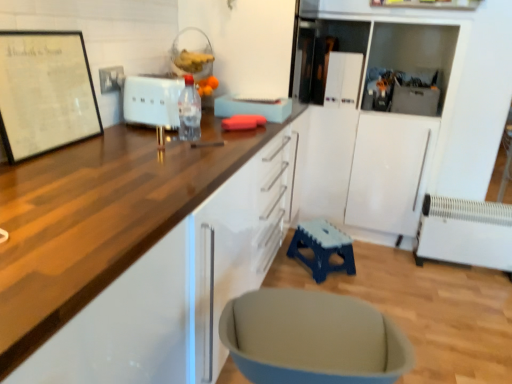
Question: In terms of height, does white plastic radiator at lower right look taller or shorter compared to white matte toaster at center, the 3th appliance from the right?

Choices:
 (A) short
 (B) tall

Answer: (B)

Question: Looking at their shapes, would you say white plastic radiator at lower right is wider or thinner than white matte toaster at center, which is the first appliance in front-to-back order?

Choices:
 (A) thin
 (B) wide

Answer: (A)

Question: Which is farther from the white glossy refrigerator at upper center, the second appliance when ordered from left to right?

Choices:
 (A) matte gray swivel chair at lower center
 (B) metallic gray toolbox at upper right, acting as the 2th appliance starting from the front
 (C) wooden countertop at upper left
 (D) white paper at upper left
 (E) white plastic radiator at lower right

Answer: (A)

Question: Which object is the farthest from the white matte toaster at center, the 3th appliance from the right?

Choices:
 (A) blue plastic stool at lower center
 (B) white plastic radiator at lower right
 (C) white glossy refrigerator at upper center, the first appliance in the back-to-front sequence
 (D) white paper at upper left
 (E) transparent plastic bottle at center

Answer: (B)